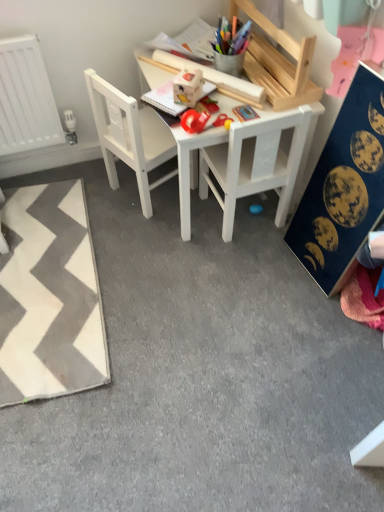
The height and width of the screenshot is (512, 384). Identify the location of vacant space that is in between dark blue fabric with celestial prints at right and white matte chair at center, which is the first chair in right-to-left order. (268, 259).